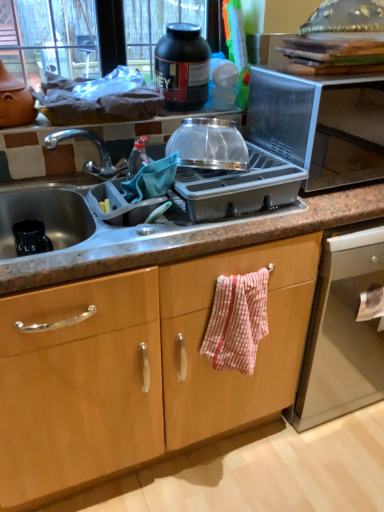
Question: Should I look upward or downward to see granite gray sink at center?

Choices:
 (A) up
 (B) down

Answer: (A)

Question: Can you confirm if granite gray sink at center is bigger than transparent plastic bowl at upper center, arranged as the 2th kitchen appliance when viewed from the top?

Choices:
 (A) yes
 (B) no

Answer: (A)

Question: From a real-world perspective, is granite gray sink at center on top of transparent plastic bowl at upper center, which is the first kitchen appliance from front to back?

Choices:
 (A) yes
 (B) no

Answer: (B)

Question: Can you confirm if granite gray sink at center is wider than transparent plastic bowl at upper center, which is the first kitchen appliance from front to back?

Choices:
 (A) no
 (B) yes

Answer: (B)

Question: From the image's perspective, is granite gray sink at center under transparent plastic bowl at upper center, the first kitchen appliance ordered from the bottom?

Choices:
 (A) yes
 (B) no

Answer: (A)

Question: Is granite gray sink at center outside of transparent plastic bowl at upper center, which is the first kitchen appliance from front to back?

Choices:
 (A) yes
 (B) no

Answer: (A)

Question: From the image's perspective, would you say granite gray sink at center is positioned over transparent plastic bowl at upper center, arranged as the 2th kitchen appliance when viewed from the top?

Choices:
 (A) yes
 (B) no

Answer: (B)

Question: Could you tell me if transparent plastic bowl at upper center, which is the first kitchen appliance from front to back, is turned towards red and white checkered fabric at center?

Choices:
 (A) no
 (B) yes

Answer: (A)

Question: Considering the relative sizes of transparent plastic bowl at upper center, which is the first kitchen appliance from front to back, and red and white checkered fabric at center in the image provided, is transparent plastic bowl at upper center, which is the first kitchen appliance from front to back, smaller than red and white checkered fabric at center?

Choices:
 (A) yes
 (B) no

Answer: (A)

Question: Does transparent plastic bowl at upper center, arranged as the 2th kitchen appliance when viewed from the top, have a lesser height compared to red and white checkered fabric at center?

Choices:
 (A) no
 (B) yes

Answer: (B)

Question: Would you say transparent plastic bowl at upper center, the second kitchen appliance in the back-to-front sequence, contains red and white checkered fabric at center?

Choices:
 (A) no
 (B) yes

Answer: (A)

Question: Considering the relative positions of transparent plastic bowl at upper center, arranged as the 2th kitchen appliance when viewed from the top, and red and white checkered fabric at center in the image provided, is transparent plastic bowl at upper center, arranged as the 2th kitchen appliance when viewed from the top, to the right of red and white checkered fabric at center from the viewer's perspective?

Choices:
 (A) no
 (B) yes

Answer: (A)

Question: Considering the relative sizes of transparent plastic bowl at upper center, the second kitchen appliance in the back-to-front sequence, and red and white checkered fabric at center in the image provided, is transparent plastic bowl at upper center, the second kitchen appliance in the back-to-front sequence, wider than red and white checkered fabric at center?

Choices:
 (A) no
 (B) yes

Answer: (B)

Question: Considering the relative sizes of red and white checkered fabric at center and granite gray sink at center in the image provided, is red and white checkered fabric at center shorter than granite gray sink at center?

Choices:
 (A) no
 (B) yes

Answer: (A)